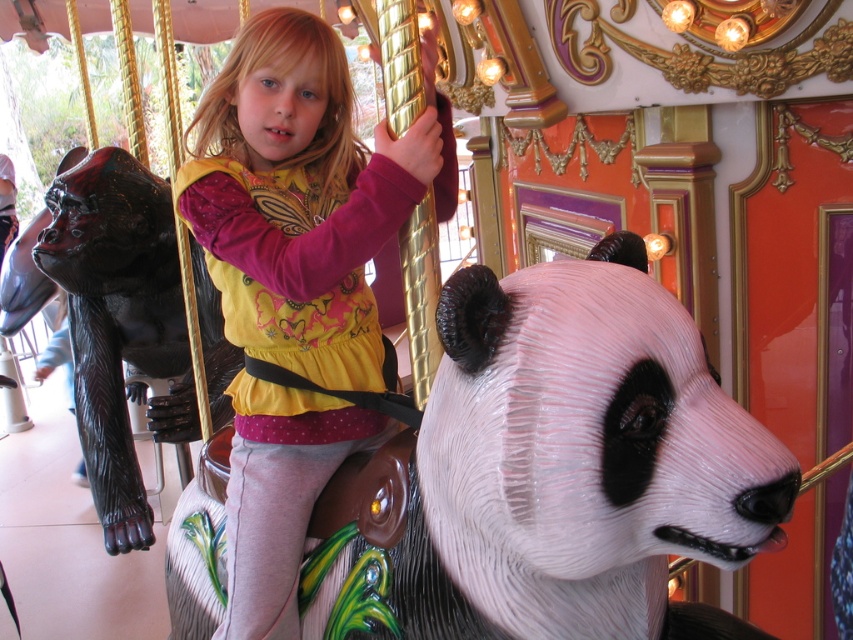
Does white glossy panda head at center have a lesser height compared to matte yellow shirt at center?

Yes.

Between white glossy panda head at center and matte yellow shirt at center, which one is positioned higher?

Positioned higher is matte yellow shirt at center.

Identify the location of white glossy panda head at center. (555, 472).

Where is `white glossy panda head at center`? This screenshot has height=640, width=853. white glossy panda head at center is located at coordinates (555, 472).